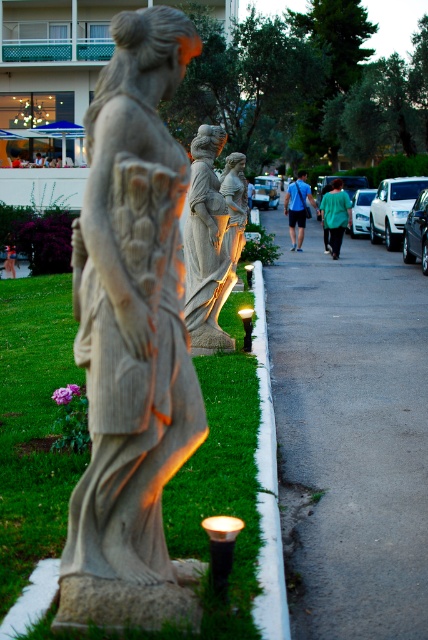
Can you confirm if gray asphalt pavement at center is positioned above white glossy car at right?

Actually, gray asphalt pavement at center is below white glossy car at right.

Between gray asphalt pavement at center and white glossy car at right, which one is positioned higher?

white glossy car at right is higher up.

Which is behind, point (341, 252) or point (392, 221)?

Positioned behind is point (341, 252).

Locate an element on the screen. The height and width of the screenshot is (640, 428). gray asphalt pavement at center is located at coordinates (350, 435).

Between white glossy car at right and blue fabric shirt at center, which one has more height?

blue fabric shirt at center is taller.

Which is behind, point (407, 205) or point (293, 228)?

The point (293, 228) is behind.

The image size is (428, 640). What do you see at coordinates (392, 209) in the screenshot?
I see `white glossy car at right` at bounding box center [392, 209].

This screenshot has height=640, width=428. Find the location of `white glossy car at right`. white glossy car at right is located at coordinates (392, 209).

Who is shorter, gray asphalt pavement at center or blue fabric shirt at center?

Standing shorter between the two is gray asphalt pavement at center.

Identify the location of gray asphalt pavement at center. This screenshot has height=640, width=428. (350, 435).

Is point (388, 394) closer to viewer compared to point (290, 202)?

Yes, it is in front of point (290, 202).

Locate an element on the screen. gray asphalt pavement at center is located at coordinates (350, 435).